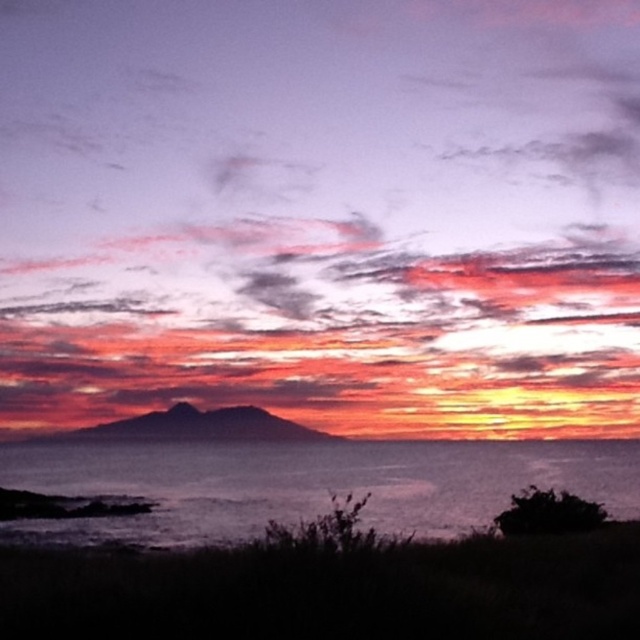
You are an astronomer observing the sunset scene. You notice a point marked at coordinates point (321, 214). What object in the scene corresponds to this coordinate?

The point (321, 214) corresponds to the matte pink cloud at center.

You are an artist painting the sunset scene described. You need to decide the vertical placement of the matte pink cloud at center and dark blue water at lower center. Which object should be placed higher in the painting?

The matte pink cloud at center should be placed higher in the painting since it has a greater height compared to the dark blue water at lower center.

You are an artist trying to paint the sunset scene. You want to ensure the matte pink cloud at center and dark blue water at lower center are proportionally accurate. Based on the scene, which object should you make wider in your painting?

The matte pink cloud at center might be wider than dark blue water at lower center, so you should make the matte pink cloud at center wider in your painting.